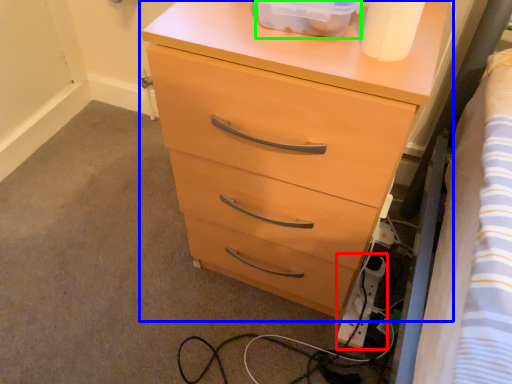
Question: Considering the real-world distances, which object is farthest from extension cord (highlighted by a red box)? chest of drawers (highlighted by a blue box) or storage box (highlighted by a green box)?

Choices:
 (A) chest of drawers
 (B) storage box

Answer: (B)